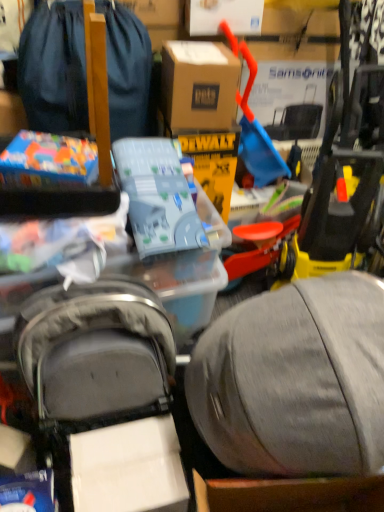
Question: Could matte plastic toy at upper left, the second toy from the right, be considered to be inside matte black backpack at upper left?

Choices:
 (A) no
 (B) yes

Answer: (A)

Question: From the image's perspective, does matte black backpack at upper left appear lower than matte plastic toy at upper left, marked as the first toy in a left-to-right arrangement?

Choices:
 (A) yes
 (B) no

Answer: (B)

Question: Is matte black backpack at upper left at the right side of matte plastic toy at upper left, marked as the first toy in a left-to-right arrangement?

Choices:
 (A) yes
 (B) no

Answer: (A)

Question: From the image's perspective, is matte black backpack at upper left above matte plastic toy at upper left, marked as the first toy in a left-to-right arrangement?

Choices:
 (A) yes
 (B) no

Answer: (A)

Question: Is matte black backpack at upper left next to matte plastic toy at upper left, marked as the first toy in a left-to-right arrangement?

Choices:
 (A) yes
 (B) no

Answer: (B)

Question: Visually, is matte plastic toy at upper left, marked as the first toy in a left-to-right arrangement, positioned to the left or to the right of brown cardboard box at center?

Choices:
 (A) right
 (B) left

Answer: (B)

Question: In terms of size, does matte plastic toy at upper left, the second toy from the right, appear bigger or smaller than brown cardboard box at center?

Choices:
 (A) big
 (B) small

Answer: (B)

Question: Is matte plastic toy at upper left, marked as the first toy in a left-to-right arrangement, in front of or behind brown cardboard box at center in the image?

Choices:
 (A) front
 (B) behind

Answer: (A)

Question: Considering the positions of matte plastic toy at upper left, marked as the first toy in a left-to-right arrangement, and brown cardboard box at center in the image, is matte plastic toy at upper left, marked as the first toy in a left-to-right arrangement, wider or thinner than brown cardboard box at center?

Choices:
 (A) thin
 (B) wide

Answer: (A)

Question: Would you say brown cardboard box at center is inside or outside translucent plastic toy at center, which is the second toy in left-to-right order?

Choices:
 (A) outside
 (B) inside

Answer: (A)

Question: Considering the positions of brown cardboard box at center and translucent plastic toy at center, which is the second toy in left-to-right order, in the image, is brown cardboard box at center taller or shorter than translucent plastic toy at center, which is the second toy in left-to-right order,?

Choices:
 (A) short
 (B) tall

Answer: (A)

Question: Relative to translucent plastic toy at center, which appears as the first toy when viewed from the right, is brown cardboard box at center in front or behind?

Choices:
 (A) behind
 (B) front

Answer: (A)

Question: Is point (206, 59) closer or farther from the camera than point (147, 179)?

Choices:
 (A) farther
 (B) closer

Answer: (A)

Question: Relative to matte plastic toy at upper left, the second toy from the right, is brown cardboard box at center in front or behind?

Choices:
 (A) behind
 (B) front

Answer: (A)

Question: Is point (170, 97) positioned closer to the camera than point (72, 162)?

Choices:
 (A) closer
 (B) farther

Answer: (B)